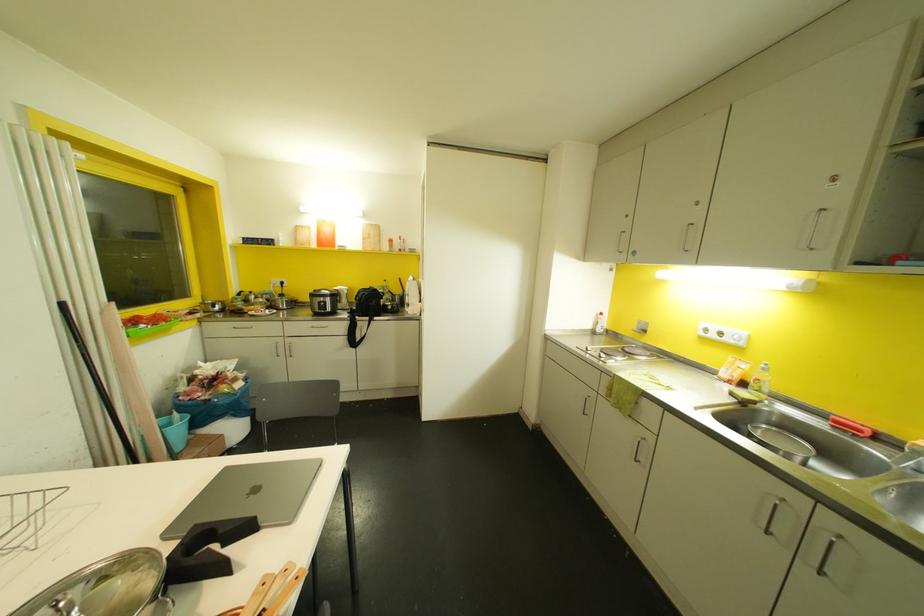
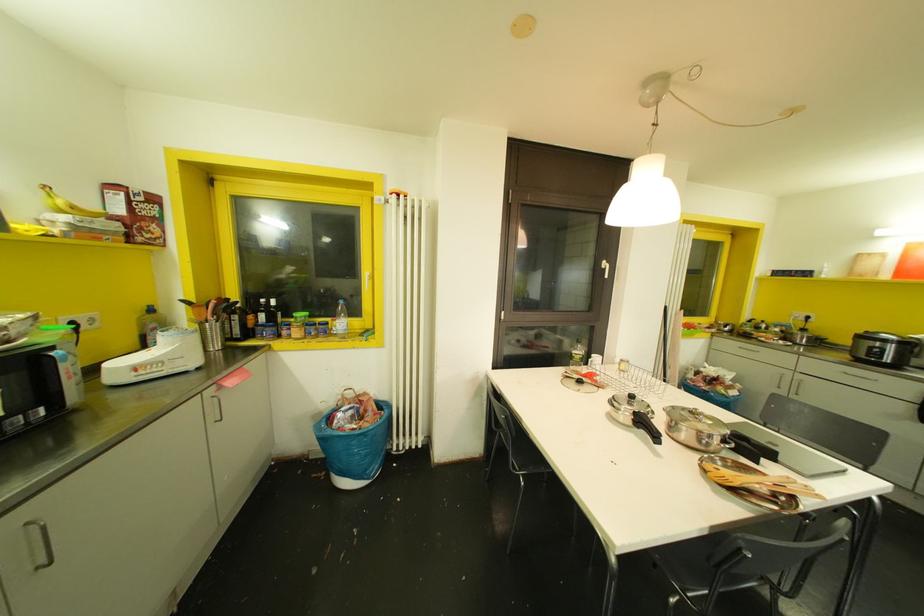
Question: The camera is either moving clockwise (left) or counter-clockwise (right) around the object. The first image is from the beginning of the video and the second image is from the end. Is the camera moving left or right when shooting the video?

Choices:
 (A) Left
 (B) Right

Answer: (B)